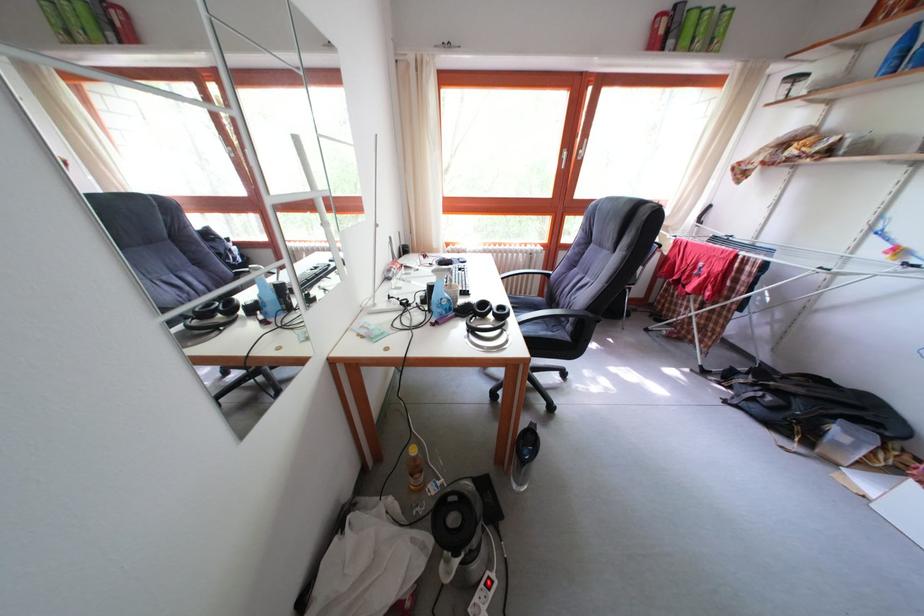
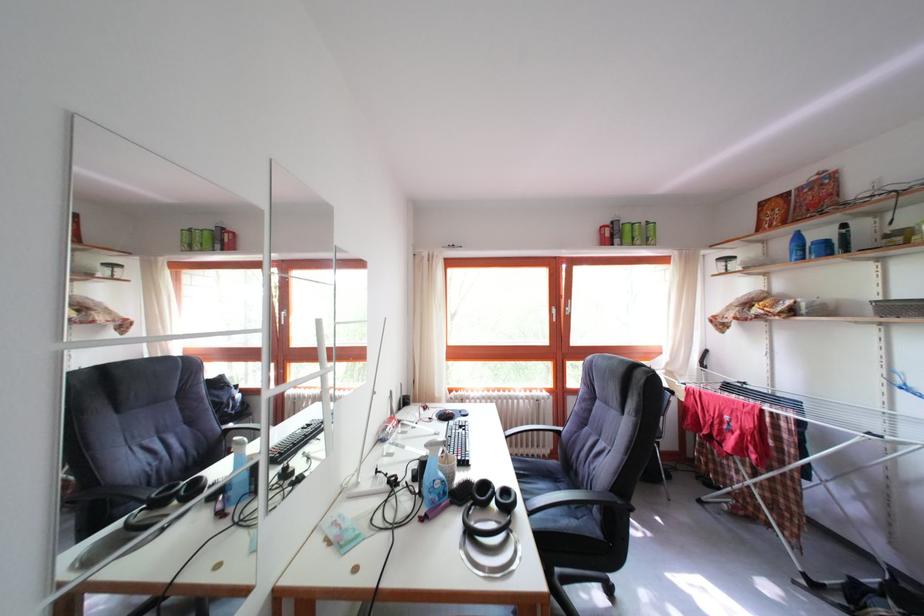
In a continuous first-person perspective shot, in which direction is the camera moving?

The cameraman moved toward right, backward.